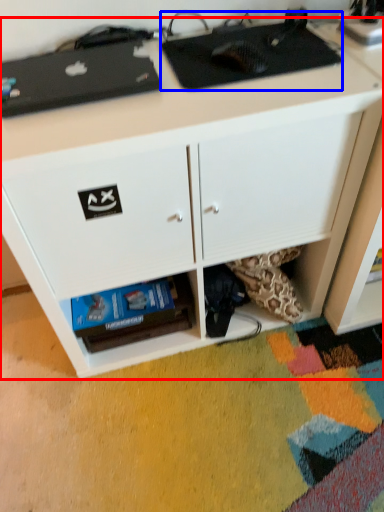
Question: Which object appears closest to the camera in this image, desk (highlighted by a red box) or appliance (highlighted by a blue box)?

Choices:
 (A) desk
 (B) appliance

Answer: (A)